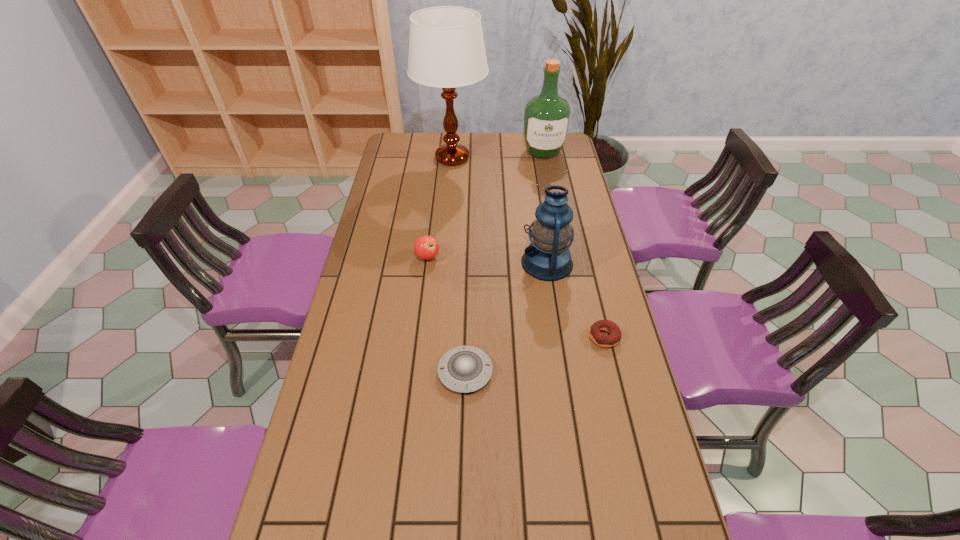
Locate an element on the screen. The width and height of the screenshot is (960, 540). object located at the far left corner is located at coordinates (446, 46).

This screenshot has height=540, width=960. I want to click on object that is at the far right corner, so click(546, 116).

In the image, there is a desktop. At what (x,y) coordinates should I click in order to perform the action: click on vacant space at the far edge. Please return your answer as a coordinate pair (x, y). Looking at the image, I should click on (480, 135).

In the image, there is a desktop. At what (x,y) coordinates should I click in order to perform the action: click on vacant space at the left edge. Please return your answer as a coordinate pair (x, y). This screenshot has width=960, height=540. Looking at the image, I should click on (404, 165).

Locate an element on the screen. free region at the right edge is located at coordinates (572, 197).

Image resolution: width=960 pixels, height=540 pixels. I want to click on free spot at the far left corner of the desktop, so click(x=391, y=153).

Find the location of a particular element. This screenshot has height=540, width=960. free space between the saucer and the fourth tallest object is located at coordinates (446, 314).

Where is `free space between the apple and the third tallest object`? The height and width of the screenshot is (540, 960). free space between the apple and the third tallest object is located at coordinates (488, 260).

Locate an element on the screen. This screenshot has height=540, width=960. free space that is in between the third shortest object and the saucer is located at coordinates (446, 314).

Find the location of a particular element. The image size is (960, 540). free spot between the table lamp and the apple is located at coordinates (441, 207).